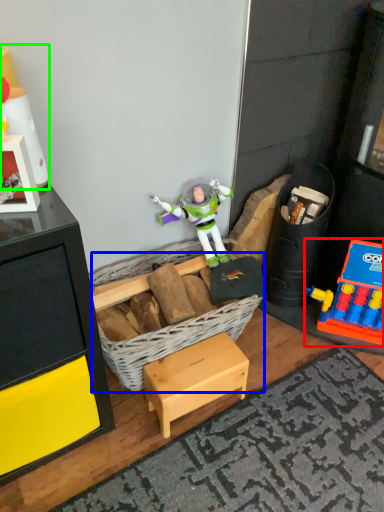
Question: Estimate the real-world distances between objects in this image. Which object is closer to toy (highlighted by a red box), basket (highlighted by a blue box) or toy (highlighted by a green box)?

Choices:
 (A) basket
 (B) toy

Answer: (A)